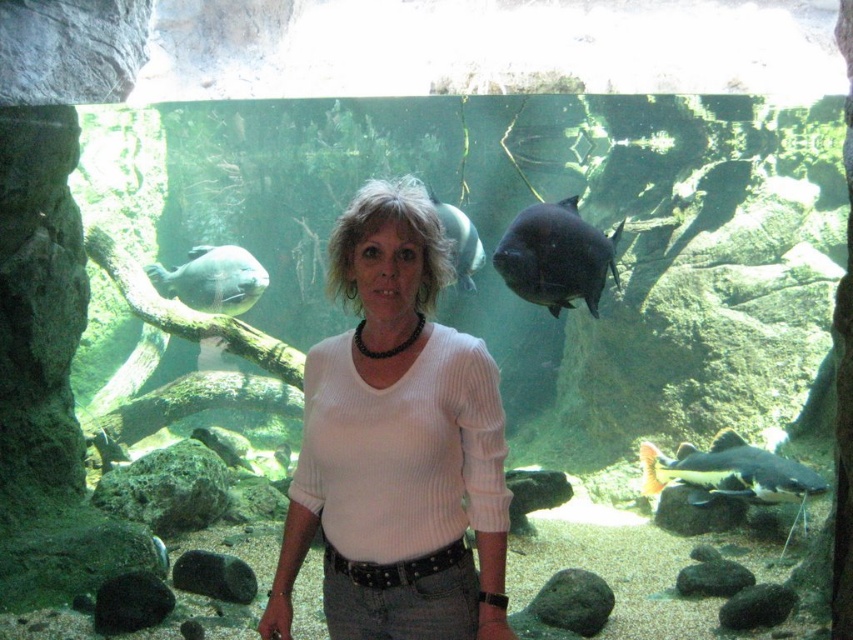
You are a marine biologist observing the black matte fish at center in the aquarium. What are the coordinates of its position?

The coordinates of the black matte fish at center are at point (x=555, y=257).

You are a marine biologist observing the aquarium. You notice two fish species in the tank. The shiny gray fish at left and the shiny silver fish at center. Which fish is bigger?

The shiny gray fish at left is larger in size compared to the shiny silver fish at center.

You are a photographer taking a picture of the woman and the aquarium. You notice two points marked in the image. Which point is closer to you, point at coordinates (532,214) or point at coordinates (183,280)?

Point at coordinates (532,214) is closer to the viewer than point at coordinates (183,280).